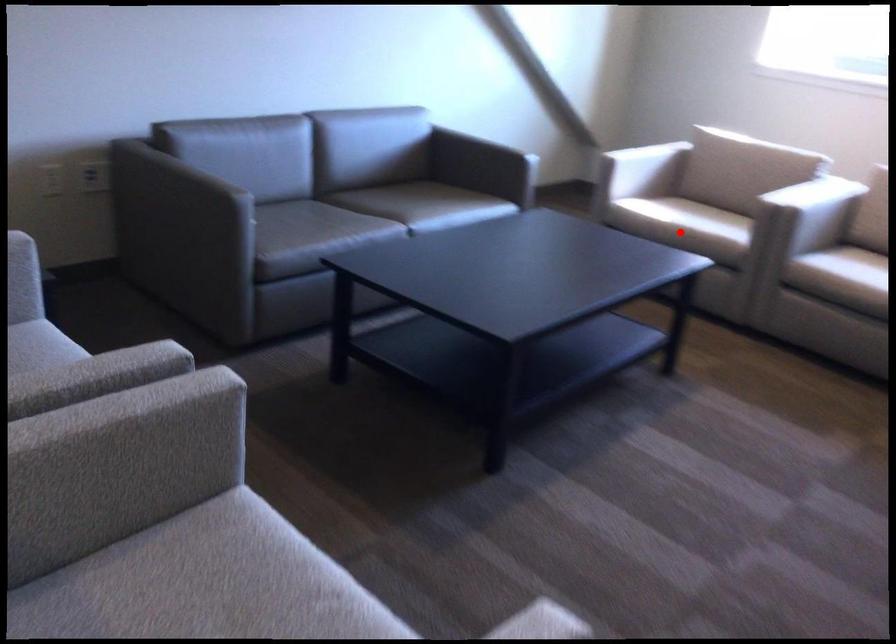
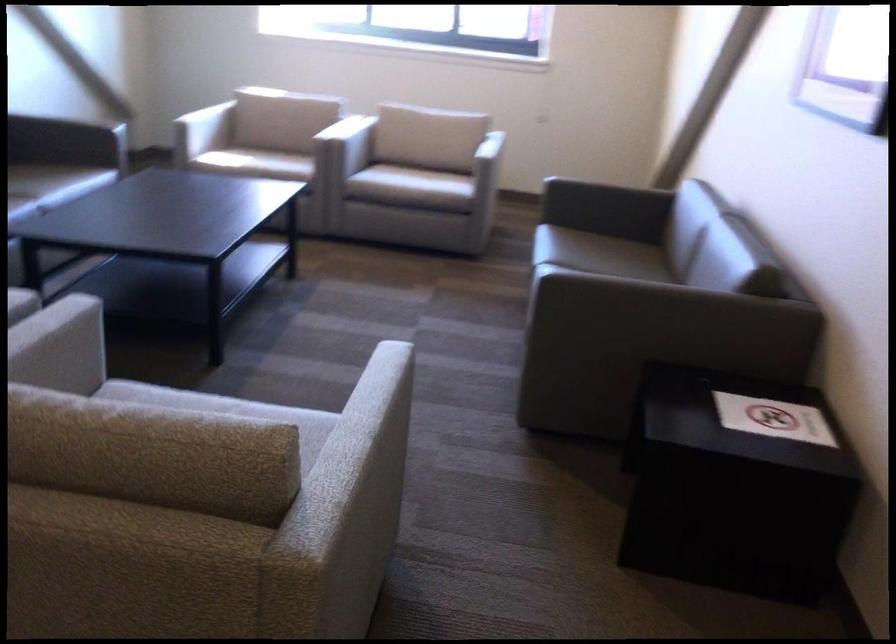
Question: I am providing you with two images of the same scene from different viewpoints. In image1, a red point is highlighted. Considering the same 3D point in image2, which of the following is correct?

Choices:
 (A) It is closer
 (B) It is farther

Answer: (B)